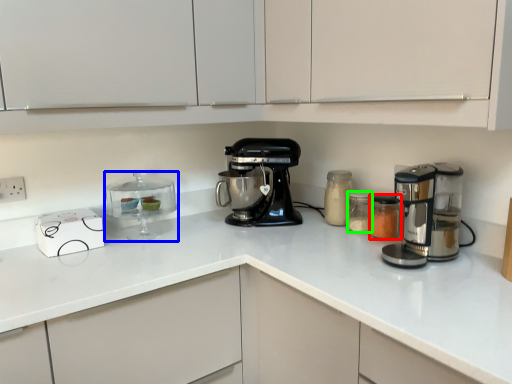
Question: Based on their relative distances, which object is nearer to appliance (highlighted by a red box)? Choose from appliance (highlighted by a blue box) and appliance (highlighted by a green box).

Choices:
 (A) appliance
 (B) appliance

Answer: (B)